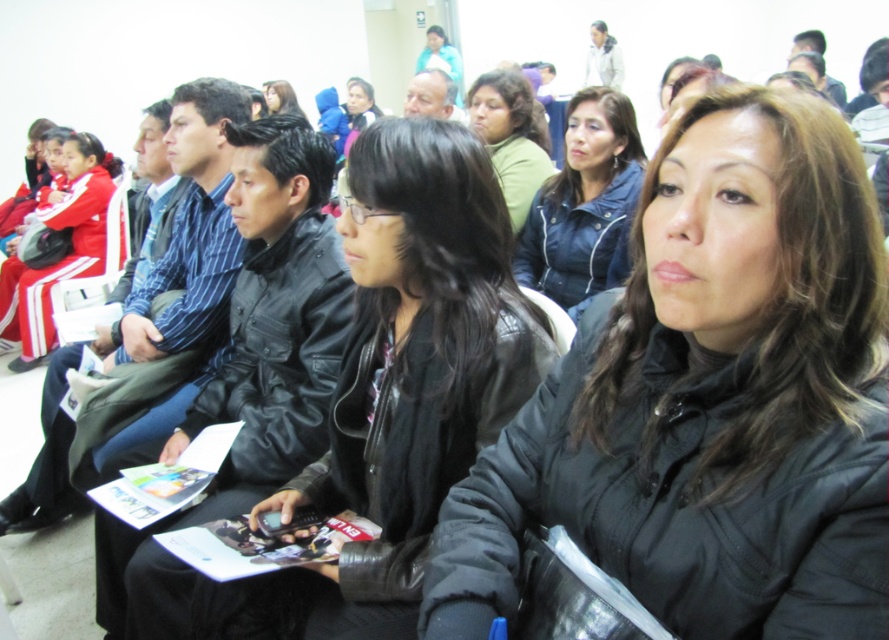
Is red matte tracksuit at left positioned behind matte black jacket at center?

No, it is not.

Can you confirm if red matte tracksuit at left is thinner than matte black jacket at center?

No.

Describe the element at coordinates (70, 248) in the screenshot. I see `red matte tracksuit at left` at that location.

Where is `red matte tracksuit at left`? The height and width of the screenshot is (640, 889). red matte tracksuit at left is located at coordinates (70, 248).

Does point (827, 136) come behind point (95, 164)?

No, it is not.

The width and height of the screenshot is (889, 640). Identify the location of black matte jacket at center. (709, 401).

Which of these two, black leather jacket at center or red matte tracksuit at left, stands taller?

red matte tracksuit at left

Locate an element on the screen. black leather jacket at center is located at coordinates [x=402, y=381].